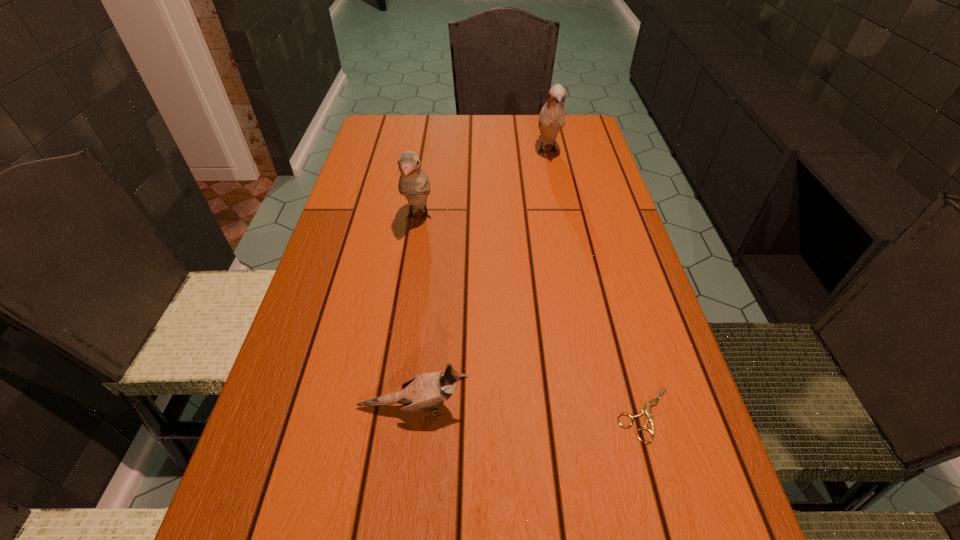
What are the coordinates of `object at the far edge` in the screenshot? It's located at (552, 117).

Locate an element on the screen. The width and height of the screenshot is (960, 540). object situated at the left edge is located at coordinates pos(424,392).

The height and width of the screenshot is (540, 960). Find the location of `bird located at the right edge`. bird located at the right edge is located at coordinates (552, 117).

The height and width of the screenshot is (540, 960). I want to click on shears that is at the right edge, so [646, 410].

This screenshot has height=540, width=960. I want to click on object that is at the far right corner, so click(552, 117).

In the image, there is a desktop. Where is `vacant region at the far edge`? The height and width of the screenshot is (540, 960). vacant region at the far edge is located at coordinates (435, 139).

The height and width of the screenshot is (540, 960). I want to click on free spot at the left edge of the desktop, so click(345, 356).

Locate an element on the screen. The image size is (960, 540). vacant space at the right edge of the desktop is located at coordinates (612, 183).

Where is `free space at the far left corner`? free space at the far left corner is located at coordinates (382, 146).

I want to click on free space between the nearest bird and the second nearest bird, so click(x=416, y=313).